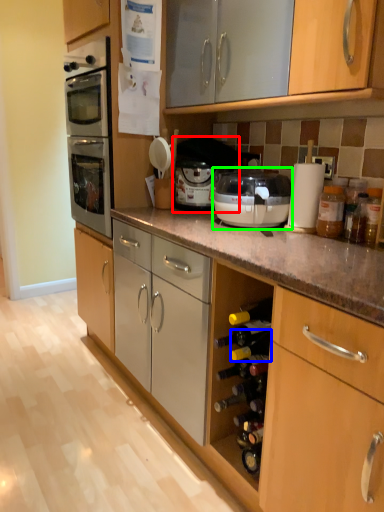
Question: Based on their relative distances, which object is farther from appliance (highlighted by a red box)? Choose from wine bottle (highlighted by a blue box) and kitchen appliance (highlighted by a green box).

Choices:
 (A) wine bottle
 (B) kitchen appliance

Answer: (A)